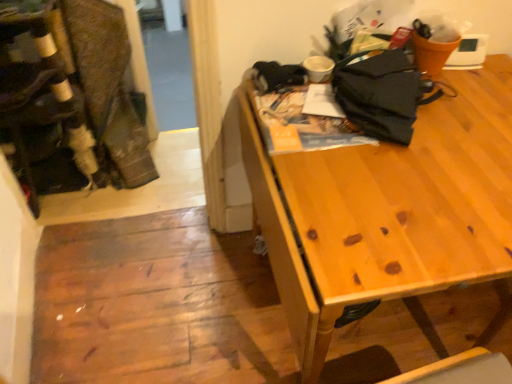
Question: In terms of height, does brown textured fabric laundry at left look taller or shorter compared to black fabric umbrella at upper right?

Choices:
 (A) short
 (B) tall

Answer: (B)

Question: From a real-world perspective, relative to black fabric umbrella at upper right, is brown textured fabric laundry at left vertically above or below?

Choices:
 (A) below
 (B) above

Answer: (A)

Question: Which object is the farthest from the brown textured fabric laundry at left?

Choices:
 (A) black fabric umbrella at upper right
 (B) velvet-like fabric at left
 (C) wooden table at upper right

Answer: (C)

Question: Which is nearer to the brown textured fabric laundry at left?

Choices:
 (A) black fabric umbrella at upper right
 (B) wooden table at upper right
 (C) velvet-like fabric at left

Answer: (C)